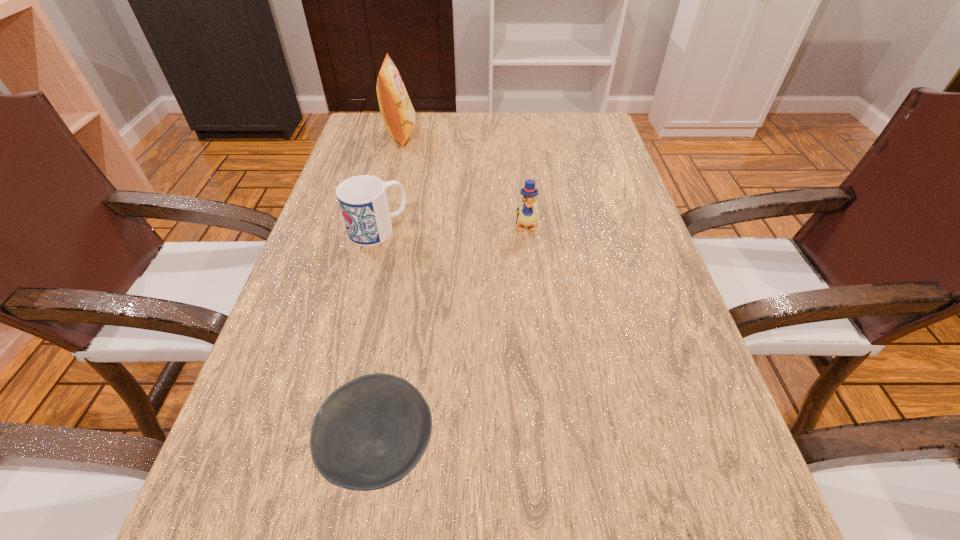
I want to click on object located at the far edge, so click(398, 114).

The image size is (960, 540). What are the coordinates of `crisp (potato chip) at the left edge` in the screenshot? It's located at (398, 114).

This screenshot has height=540, width=960. Identify the location of mug at the left edge. (363, 202).

Where is `bowl at the left edge`? Image resolution: width=960 pixels, height=540 pixels. bowl at the left edge is located at coordinates (371, 432).

This screenshot has width=960, height=540. I want to click on object that is at the far left corner, so click(398, 114).

This screenshot has height=540, width=960. In the image, there is a desktop. What are the coordinates of `vacant space at the far edge` in the screenshot? It's located at (415, 137).

Where is `free space at the left edge of the desktop`? free space at the left edge of the desktop is located at coordinates (312, 295).

The image size is (960, 540). In the image, there is a desktop. Find the location of `vacant space at the right edge`. vacant space at the right edge is located at coordinates (564, 167).

Where is `vacant space at the far left corner`? This screenshot has width=960, height=540. vacant space at the far left corner is located at coordinates (378, 119).

I want to click on free space at the far right corner of the desktop, so click(573, 150).